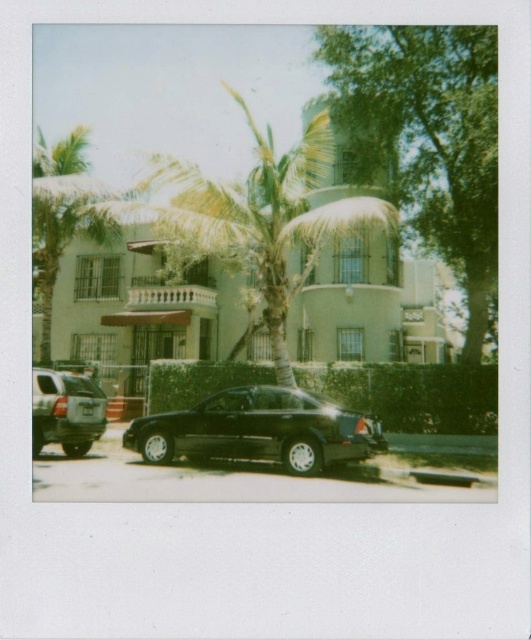
Question: Estimate the real-world distances between objects in this image. Which object is farther from the beige stucco building at center?

Choices:
 (A) matte black suv at lower left
 (B) green leafy tree at upper right

Answer: (A)

Question: Is black matte car at center bigger than matte black suv at lower left?

Choices:
 (A) yes
 (B) no

Answer: (A)

Question: Is beige stucco building at center smaller than black matte car at center?

Choices:
 (A) yes
 (B) no

Answer: (B)

Question: Considering the real-world distances, which object is closest to the black matte car at center?

Choices:
 (A) green leafy tree at upper right
 (B) beige stucco building at center
 (C) matte black suv at lower left

Answer: (C)

Question: Which object appears farthest from the camera in this image?

Choices:
 (A) beige stucco building at center
 (B) matte black suv at lower left
 (C) black matte car at center

Answer: (A)

Question: Does green leafy tree at upper right have a greater width compared to black matte car at center?

Choices:
 (A) no
 (B) yes

Answer: (B)